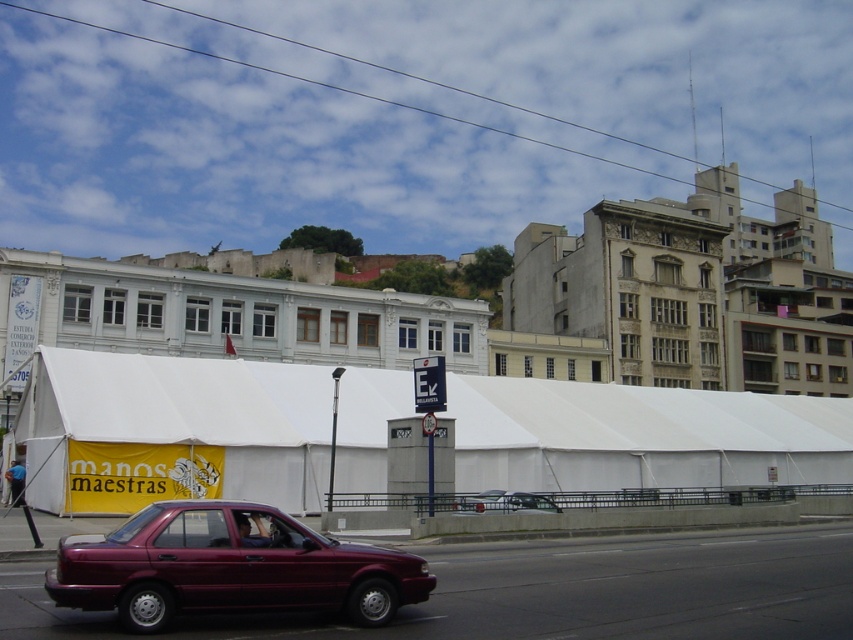
Question: Which point appears farthest from the camera in this image?

Choices:
 (A) (492, 497)
 (B) (712, 476)

Answer: (B)

Question: Is white fabric tent at center closer to the viewer compared to metallic silver sedan at center?

Choices:
 (A) yes
 (B) no

Answer: (B)

Question: Is maroon metallic sedan at lower left closer to camera compared to metallic silver sedan at center?

Choices:
 (A) no
 (B) yes

Answer: (B)

Question: Based on their relative distances, which object is nearer to the maroon metallic sedan at lower left?

Choices:
 (A) white fabric tent at center
 (B) metallic silver sedan at center

Answer: (B)

Question: Is white fabric tent at center bigger than maroon metallic sedan at lower left?

Choices:
 (A) yes
 (B) no

Answer: (A)

Question: Which of the following is the closest to the observer?

Choices:
 (A) white fabric tent at center
 (B) maroon metallic sedan at lower left
 (C) metallic silver sedan at center

Answer: (B)